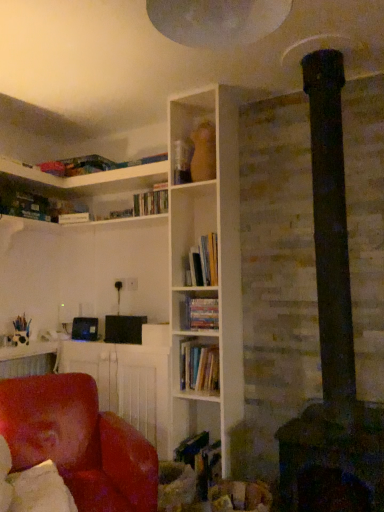
Question: Is hardcover books at center, acting as the first book starting from the top, taller than leather at left?

Choices:
 (A) yes
 (B) no

Answer: (B)

Question: Does hardcover books at center, the third book from the bottom, come behind leather at left?

Choices:
 (A) no
 (B) yes

Answer: (B)

Question: From the image's perspective, would you say hardcover books at center, acting as the first book starting from the top, is positioned over leather at left?

Choices:
 (A) yes
 (B) no

Answer: (A)

Question: Considering the relative sizes of hardcover books at center, acting as the first book starting from the top, and leather at left in the image provided, is hardcover books at center, acting as the first book starting from the top, shorter than leather at left?

Choices:
 (A) no
 (B) yes

Answer: (B)

Question: Is hardcover books at center, acting as the first book starting from the top, positioned with its back to leather at left?

Choices:
 (A) yes
 (B) no

Answer: (B)

Question: From a real-world perspective, is hardcover books at center, the third book from the bottom, below leather at left?

Choices:
 (A) no
 (B) yes

Answer: (A)

Question: From the image's perspective, is leather at left beneath hardcover books at center, the first book in the bottom-to-top sequence?

Choices:
 (A) yes
 (B) no

Answer: (A)

Question: Is leather at left at the left side of hardcover books at center, the third book when ordered from top to bottom?

Choices:
 (A) no
 (B) yes

Answer: (B)

Question: Is leather at left oriented away from hardcover books at center, the first book in the bottom-to-top sequence?

Choices:
 (A) yes
 (B) no

Answer: (B)

Question: Is leather at left outside of hardcover books at center, the first book in the bottom-to-top sequence?

Choices:
 (A) yes
 (B) no

Answer: (A)

Question: Would you consider leather at left to be distant from hardcover books at center, the third book when ordered from top to bottom?

Choices:
 (A) no
 (B) yes

Answer: (A)

Question: Is hardcover books at center, the first book in the bottom-to-top sequence, surrounded by leather at left?

Choices:
 (A) no
 (B) yes

Answer: (A)

Question: Considering the relative positions of hardcover books at center, which ranks as the second book in top-to-bottom order, and matte red chair at lower left in the image provided, is hardcover books at center, which ranks as the second book in top-to-bottom order, to the left of matte red chair at lower left from the viewer's perspective?

Choices:
 (A) no
 (B) yes

Answer: (A)